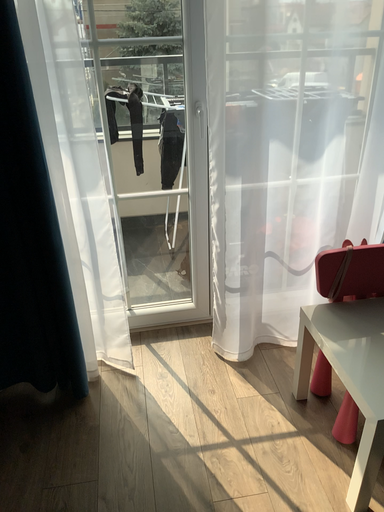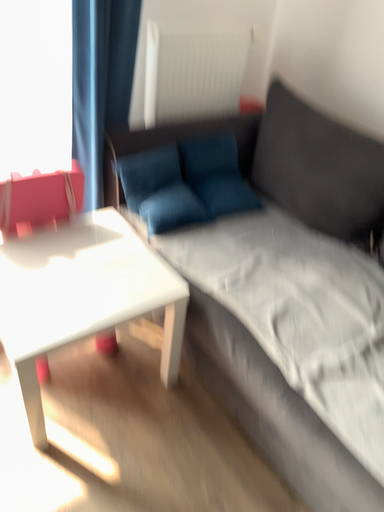
Question: Which way did the camera rotate in the video?

Choices:
 (A) rotated upward
 (B) rotated downward

Answer: (B)